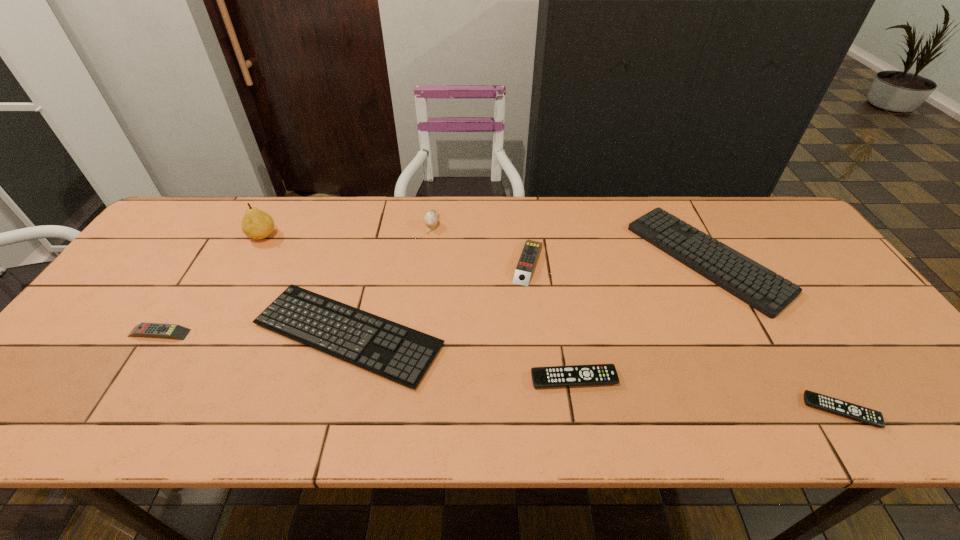
I want to click on empty space between the escargot and the right computer keyboard, so (569, 240).

The height and width of the screenshot is (540, 960). I want to click on vacant point located between the farthest remote control and the left black remote control, so click(551, 320).

This screenshot has height=540, width=960. In order to click on vacant space that's between the third farthest remote control and the right black remote control in this screenshot , I will do `click(708, 395)`.

Select which object is the fourth closest to the bigger black remote control. Please provide its 2D coordinates. Your answer should be formatted as a tuple, i.e. [(x, y)], where the tuple contains the x and y coordinates of a point satisfying the conditions above.

[(859, 413)]

The height and width of the screenshot is (540, 960). What are the coordinates of `object that is the sixth closest to the seventh object from right to left` in the screenshot? It's located at (754, 284).

Identify which remote control is the third closest to the third nearest remote control. Please provide its 2D coordinates. Your answer should be formatted as a tuple, i.e. [(x, y)], where the tuple contains the x and y coordinates of a point satisfying the conditions above.

[(859, 413)]

Where is `the fourth closest remote control to the taller computer keyboard`? Image resolution: width=960 pixels, height=540 pixels. the fourth closest remote control to the taller computer keyboard is located at coordinates (174, 331).

I want to click on blank space that satisfies the following two spatial constraints: 1. on the front side of the farther black remote control; 2. on the left side of the third nearest remote control, so click(130, 379).

Find the location of a particular element. Image resolution: width=960 pixels, height=540 pixels. free space that satisfies the following two spatial constraints: 1. on the front side of the third nearest remote control; 2. on the left side of the shorter computer keyboard is located at coordinates (158, 334).

Where is `free space that satisfies the following two spatial constraints: 1. on the shell of the nearer black remote control; 2. on the right side of the escargot`? This screenshot has width=960, height=540. free space that satisfies the following two spatial constraints: 1. on the shell of the nearer black remote control; 2. on the right side of the escargot is located at coordinates (409, 410).